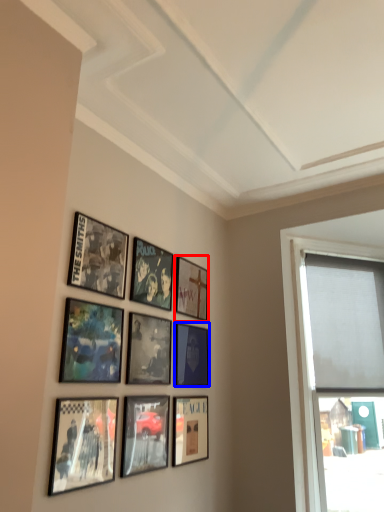
Question: Which point is closer to the camera, picture frame (highlighted by a red box) or picture frame (highlighted by a blue box)?

Choices:
 (A) picture frame
 (B) picture frame

Answer: (B)